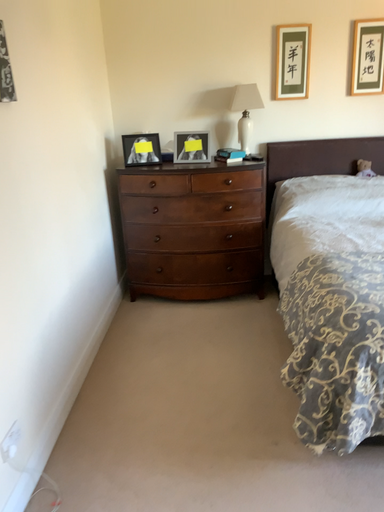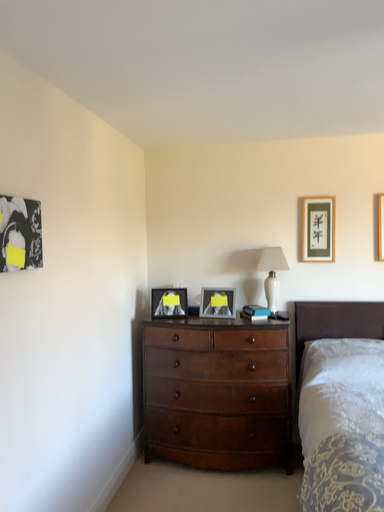
Question: How did the camera likely rotate when shooting the video?

Choices:
 (A) rotated left
 (B) rotated right

Answer: (A)